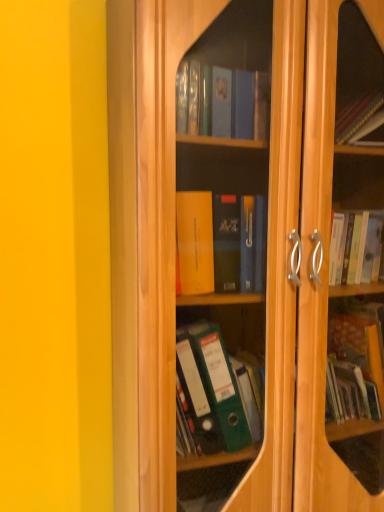
You are a GUI agent. You are given a task and a screenshot of the screen. Output one action in this format:
    pyautogui.click(x=<x>, y=<y>)
    Task: Click on the wooden bookcase at center
    Image resolution: width=384 pixels, height=512 pixels.
    Given the screenshot: What is the action you would take?
    pyautogui.click(x=246, y=257)

What do you see at coordinates (246, 257) in the screenshot? This screenshot has width=384, height=512. I see `wooden bookcase at center` at bounding box center [246, 257].

This screenshot has width=384, height=512. In order to click on wooden bookcase at center in this screenshot , I will do `click(246, 257)`.